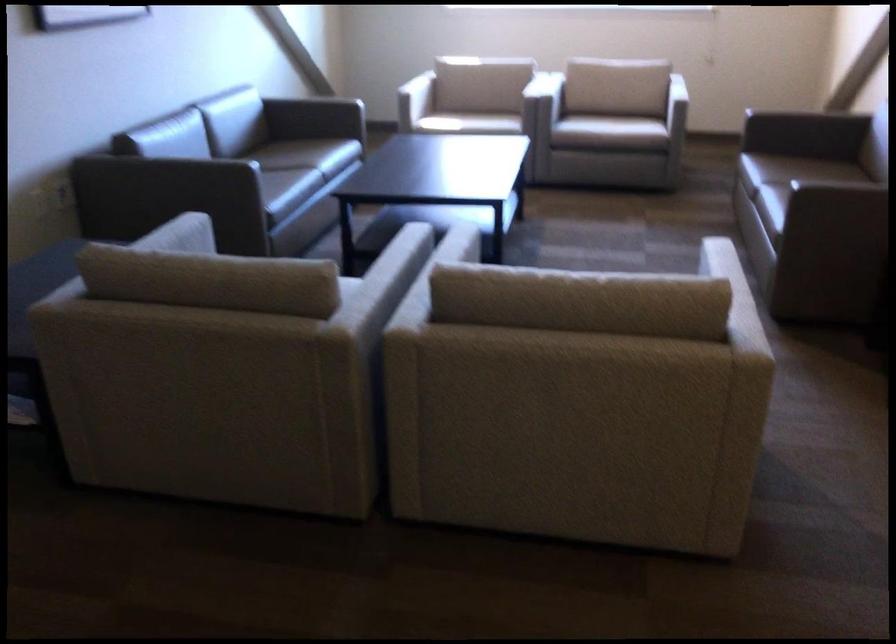
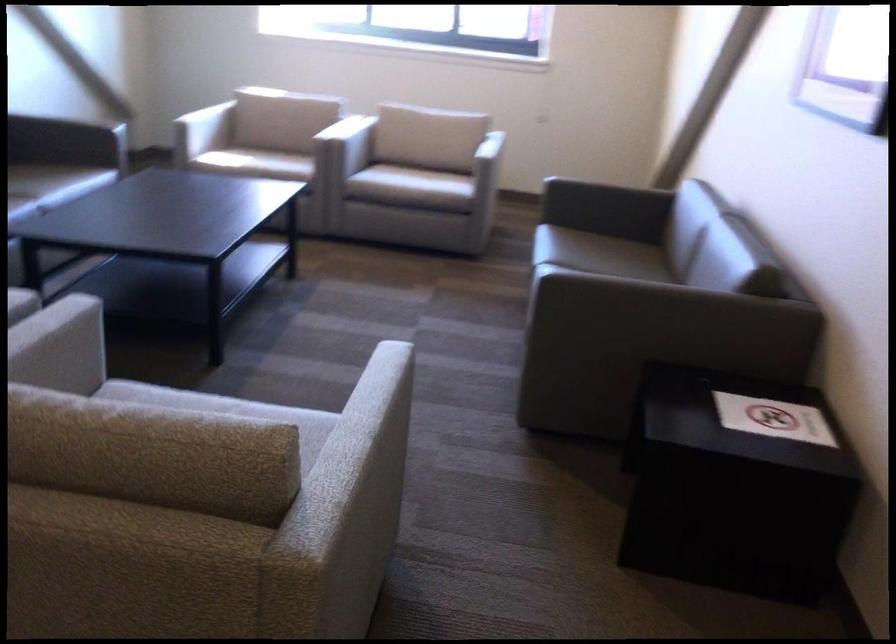
Find the pixel in the second image that matches (x=586, y=252) in the first image.

(352, 330)